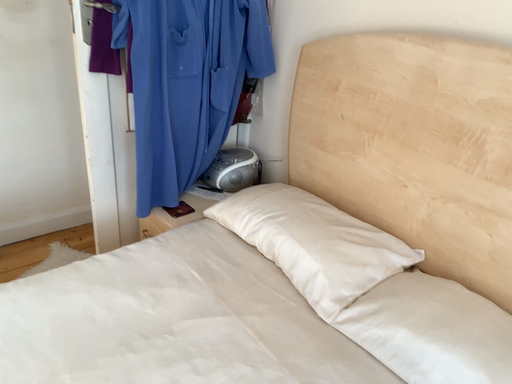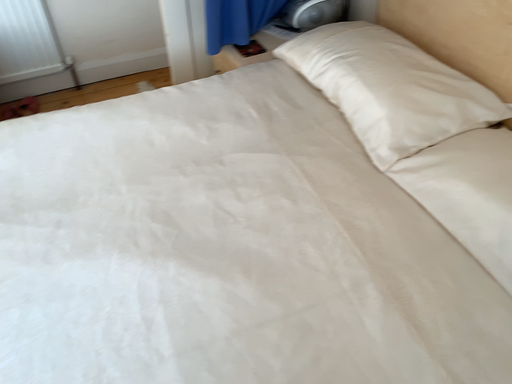
Question: How did the camera likely rotate when shooting the video?

Choices:
 (A) rotated upward
 (B) rotated downward

Answer: (B)